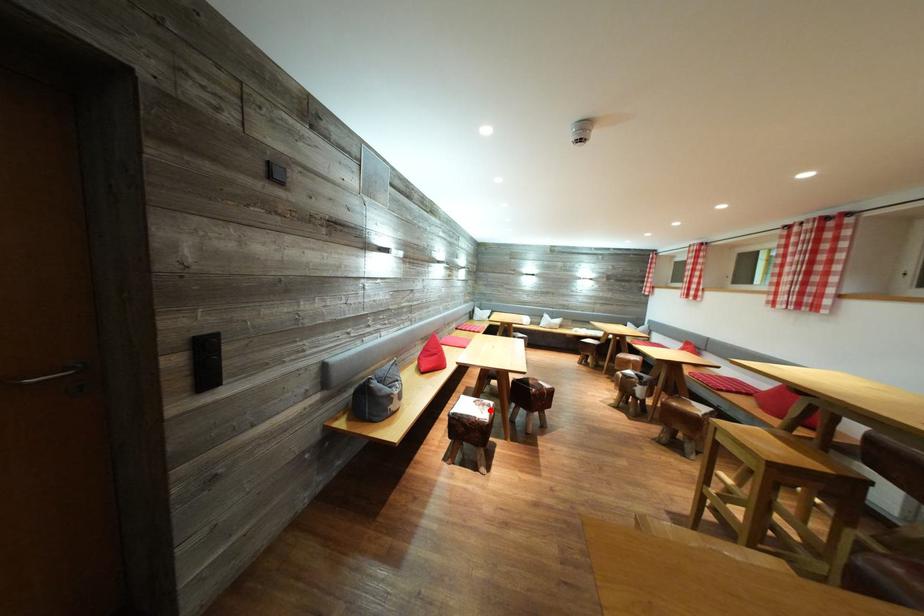
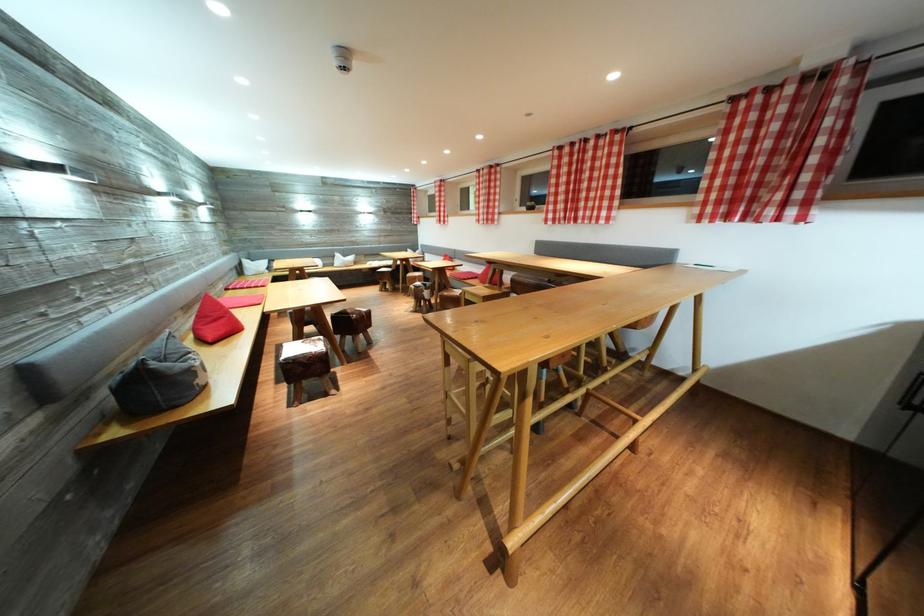
Question: I am providing you with two images of the same scene from different viewpoints. A red point is shown in image1. For the corresponding object point in image2, is it positioned nearer or farther from the camera?

Choices:
 (A) Nearer
 (B) Farther

Answer: (A)